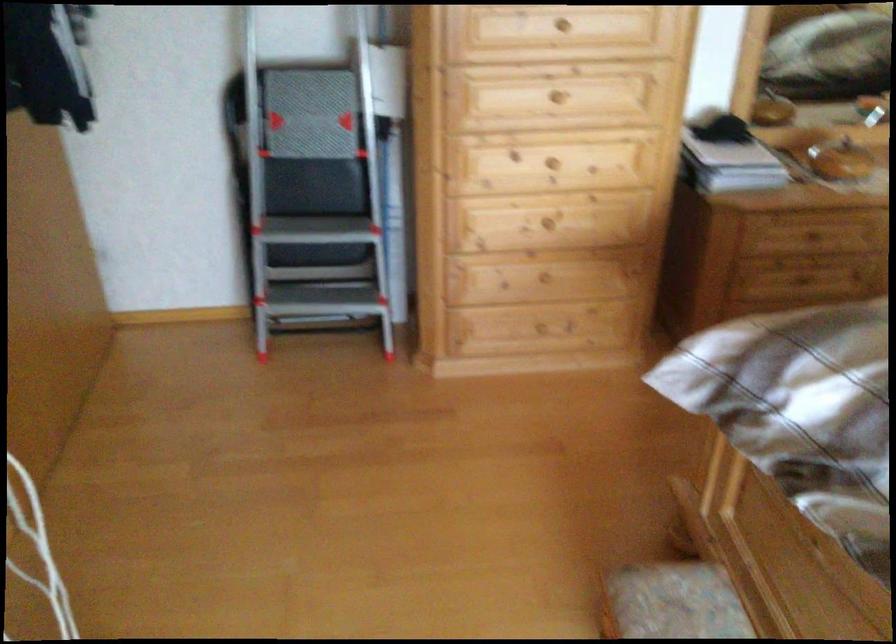
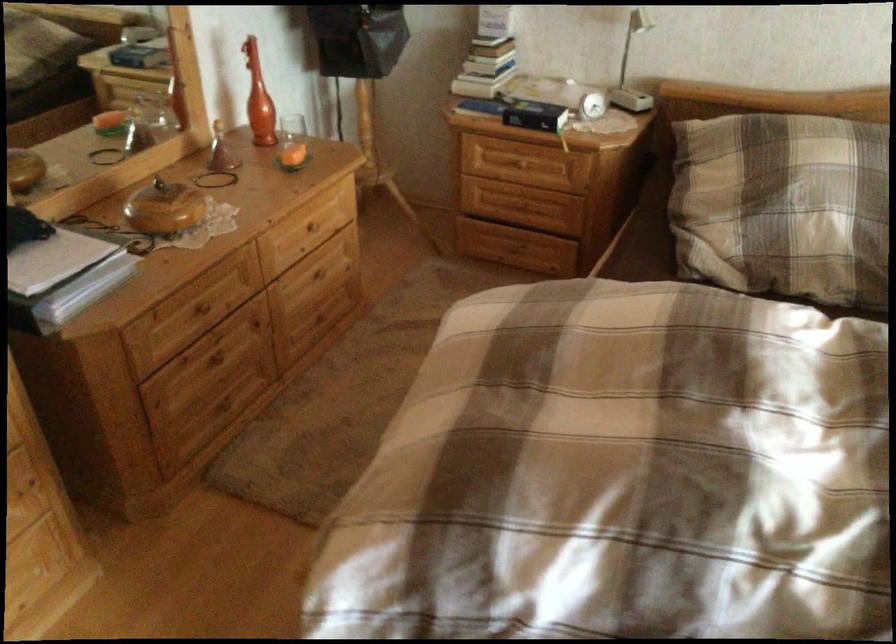
Locate, in the second image, the point that corresponds to (817,225) in the first image.

(207, 307)